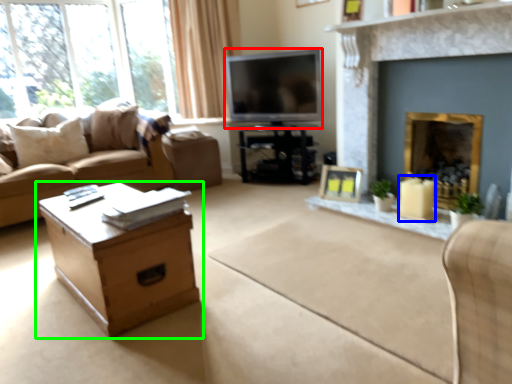
Question: Considering the real-world distances, which object is closest to television (highlighted by a red box)? candle holder (highlighted by a blue box) or table (highlighted by a green box).

Choices:
 (A) candle holder
 (B) table

Answer: (A)